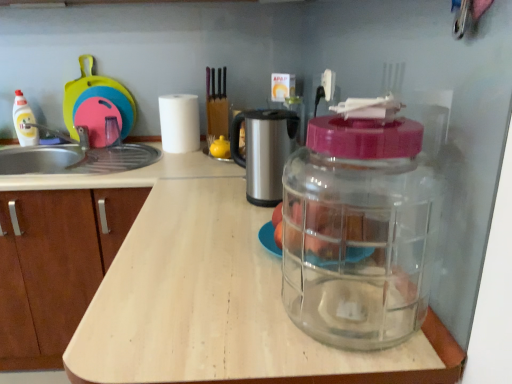
Locate an element on the screen. transparent plastic container at center, marked as the first bottle in a right-to-left arrangement is located at coordinates (359, 231).

Locate an element on the screen. Image resolution: width=512 pixels, height=384 pixels. white matte paper towel at center is located at coordinates (179, 123).

What do you see at coordinates (97, 105) in the screenshot? This screenshot has height=384, width=512. I see `rubberized plastic cutting board at upper left` at bounding box center [97, 105].

The height and width of the screenshot is (384, 512). What do you see at coordinates (329, 232) in the screenshot?
I see `translucent glass apples at center` at bounding box center [329, 232].

What do you see at coordinates (264, 151) in the screenshot? This screenshot has height=384, width=512. I see `stainless steel coffee maker at center` at bounding box center [264, 151].

I want to click on transparent wood countertop at center, so click(221, 307).

Considering the sizes of objects translucent glass apples at center and white plastic bottle at left, acting as the second bottle starting from the bottom, in the image provided, who is thinner, translucent glass apples at center or white plastic bottle at left, acting as the second bottle starting from the bottom,?

Thinner between the two is white plastic bottle at left, acting as the second bottle starting from the bottom.

In the image, is translucent glass apples at center on the left side or the right side of white plastic bottle at left, acting as the second bottle starting from the bottom?

translucent glass apples at center is to the right of white plastic bottle at left, acting as the second bottle starting from the bottom.

How different are the orientations of translucent glass apples at center and white plastic bottle at left, the 1th bottle when ordered from left to right, in degrees?

They differ by 89.5 degrees in their facing directions.

From the image's perspective, between translucent glass apples at center and white plastic bottle at left, placed as the 1th bottle when sorted from back to front, who is located below?

translucent glass apples at center.

From a real-world perspective, is transparent wood countertop at center below translucent glass apples at center?

Yes, from a real-world perspective, transparent wood countertop at center is beneath translucent glass apples at center.

Can you confirm if transparent wood countertop at center is thinner than translucent glass apples at center?

No.

Does transparent wood countertop at center have a lesser height compared to translucent glass apples at center?

No.

Is transparent wood countertop at center behind translucent glass apples at center?

No.

Looking at this image, does white matte paper towel at center appear on the right side of stainless steel coffee maker at center?

No.

Is white matte paper towel at center turned away from stainless steel coffee maker at center?

No, white matte paper towel at center is not facing the opposite direction of stainless steel coffee maker at center.

Between white matte paper towel at center and stainless steel coffee maker at center, which one is positioned in front?

stainless steel coffee maker at center is more forward.

From the image's perspective, is white matte paper towel at center beneath stainless steel coffee maker at center?

Incorrect, from the image's perspective, white matte paper towel at center is higher than stainless steel coffee maker at center.

Is translucent glass apples at center next to transparent plastic container at center, which is the second bottle in back-to-front order?

Yes, translucent glass apples at center is with transparent plastic container at center, which is the second bottle in back-to-front order.

Do you think translucent glass apples at center is within transparent plastic container at center, which is the second bottle in back-to-front order, or outside of it?

translucent glass apples at center is spatially situated outside transparent plastic container at center, which is the second bottle in back-to-front order.

Is point (354, 238) closer to viewer compared to point (422, 267)?

That is False.

Is translucent glass apples at center thinner than transparent plastic container at center, marked as the first bottle in a right-to-left arrangement?

In fact, translucent glass apples at center might be wider than transparent plastic container at center, marked as the first bottle in a right-to-left arrangement.

Which is behind, rubberized plastic cutting board at upper left or transparent plastic container at center, marked as the first bottle in a right-to-left arrangement?

rubberized plastic cutting board at upper left is more distant.

In the scene shown: Between rubberized plastic cutting board at upper left and transparent plastic container at center, which is the second bottle in top-to-bottom order, which one appears on the left side from the viewer's perspective?

From the viewer's perspective, rubberized plastic cutting board at upper left appears more on the left side.

Considering the points (73, 136) and (367, 240), which point is behind, point (73, 136) or point (367, 240)?

The point (73, 136) is more distant.

Is rubberized plastic cutting board at upper left far from transparent plastic container at center, which is the second bottle in back-to-front order?

Absolutely, rubberized plastic cutting board at upper left is distant from transparent plastic container at center, which is the second bottle in back-to-front order.

From the image's perspective, which is below, transparent wood countertop at center or white matte paper towel at center?

transparent wood countertop at center.

Considering the sizes of objects transparent wood countertop at center and white matte paper towel at center in the image provided, who is wider, transparent wood countertop at center or white matte paper towel at center?

transparent wood countertop at center.

Is transparent wood countertop at center taller than white matte paper towel at center?

Yes, transparent wood countertop at center is taller than white matte paper towel at center.

Considering the points (324, 160) and (88, 90), which point is behind, point (324, 160) or point (88, 90)?

Positioned behind is point (88, 90).

Which is more to the left, transparent plastic container at center, which is the second bottle in top-to-bottom order, or rubberized plastic cutting board at upper left?

Positioned to the left is rubberized plastic cutting board at upper left.

Is transparent plastic container at center, which is the second bottle in top-to-bottom order, shorter than rubberized plastic cutting board at upper left?

Indeed, transparent plastic container at center, which is the second bottle in top-to-bottom order, has a lesser height compared to rubberized plastic cutting board at upper left.

The image size is (512, 384). What are the coordinates of `bottle that appears on the left of translucent glass apples at center` in the screenshot? It's located at (24, 121).

At what (x,y) coordinates should I click in order to perform the action: click on food located above the transparent wood countertop at center (from the image's perspective). Please return your answer as a coordinate pair (x, y). The height and width of the screenshot is (384, 512). Looking at the image, I should click on (329, 232).

From the image, which object appears to be nearer to stainless steel coffee maker at center, rubberized plastic cutting board at upper left or transparent plastic container at center, which is the 1th bottle from front to back?

transparent plastic container at center, which is the 1th bottle from front to back, is closer to stainless steel coffee maker at center.

From the image, which object appears to be farther from white matte paper towel at center, stainless steel coffee maker at center or transparent plastic container at center, which ranks as the second bottle in left-to-right order?

Based on the image, transparent plastic container at center, which ranks as the second bottle in left-to-right order, appears to be further to white matte paper towel at center.

When comparing their distances from stainless steel coffee maker at center, does white plastic bottle at left, placed as the 1th bottle when sorted from back to front, or rubberized plastic cutting board at upper left seem further?

Based on the image, white plastic bottle at left, placed as the 1th bottle when sorted from back to front, appears to be further to stainless steel coffee maker at center.

From the picture: From the image, which object appears to be nearer to white plastic bottle at left, the 2th bottle viewed from the front, stainless steel coffee maker at center or transparent wood countertop at center?

stainless steel coffee maker at center lies closer to white plastic bottle at left, the 2th bottle viewed from the front, than the other object.

Which object lies further to the anchor point transparent plastic container at center, which is the first bottle from bottom to top, stainless steel coffee maker at center or rubberized plastic cutting board at upper left?

Based on the image, rubberized plastic cutting board at upper left appears to be further to transparent plastic container at center, which is the first bottle from bottom to top.

Estimate the real-world distances between objects in this image. Which object is closer to white matte paper towel at center, rubberized plastic cutting board at upper left or white plastic bottle at left, placed as the 1th bottle when sorted from top to bottom?

Among the two, rubberized plastic cutting board at upper left is located nearer to white matte paper towel at center.

When comparing their distances from rubberized plastic cutting board at upper left, does stainless steel coffee maker at center or white matte paper towel at center seem further?

stainless steel coffee maker at center is further to rubberized plastic cutting board at upper left.

Looking at this image, looking at the image, which one is located further to stainless steel coffee maker at center, transparent plastic container at center, which is the 1th bottle from front to back, or rubberized plastic cutting board at upper left?

The object further to stainless steel coffee maker at center is rubberized plastic cutting board at upper left.

You are a GUI agent. You are given a task and a screenshot of the screen. Output one action in this format:
    pyautogui.click(x=<x>, y=<y>)
    Task: Click on the appliance between white plastic bottle at left, positioned as the 2th bottle in right-to-left order, and translucent glass apples at center from left to right
    
    Given the screenshot: What is the action you would take?
    pyautogui.click(x=97, y=105)

Where is `coffee machine located between translucent glass apples at center and rubberized plastic cutting board at upper left in the depth direction`? Image resolution: width=512 pixels, height=384 pixels. coffee machine located between translucent glass apples at center and rubberized plastic cutting board at upper left in the depth direction is located at coordinates (264, 151).

Locate an element on the screen. The height and width of the screenshot is (384, 512). paper towel located between transparent wood countertop at center and rubberized plastic cutting board at upper left in the depth direction is located at coordinates (179, 123).

Where is `coffee machine between transparent wood countertop at center and white matte paper towel at center in the front-back direction`? This screenshot has height=384, width=512. coffee machine between transparent wood countertop at center and white matte paper towel at center in the front-back direction is located at coordinates (264, 151).